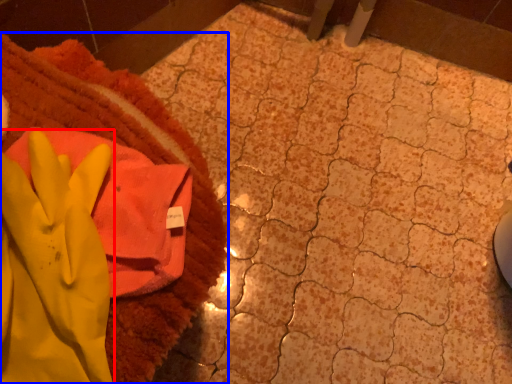
Question: Which object is closer to the camera taking this photo, glove (highlighted by a red box) or towel (highlighted by a blue box)?

Choices:
 (A) glove
 (B) towel

Answer: (A)